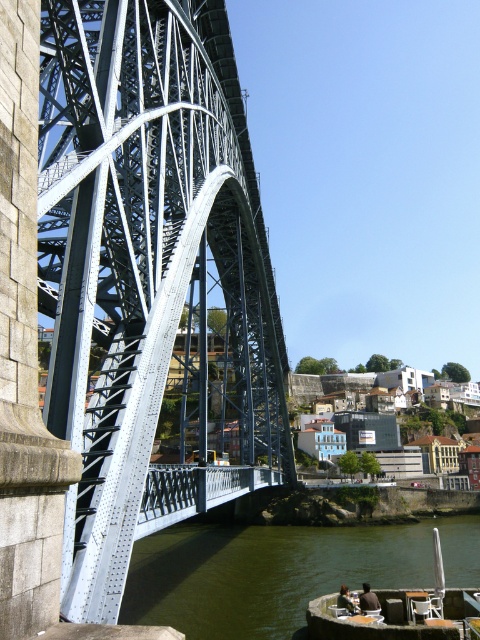
Question: Can you confirm if greenish water at lower center is bigger than wooden boat at lower right?

Choices:
 (A) no
 (B) yes

Answer: (B)

Question: Considering the real-world distances, which object is closest to the metallic steel arch bridge at left?

Choices:
 (A) greenish water at lower center
 (B) wooden boat at lower right

Answer: (A)

Question: Considering the real-world distances, which object is closest to the wooden boat at lower right?

Choices:
 (A) greenish water at lower center
 (B) metallic steel arch bridge at left

Answer: (A)

Question: Which object appears closest to the camera in this image?

Choices:
 (A) metallic steel arch bridge at left
 (B) greenish water at lower center
 (C) wooden boat at lower right

Answer: (A)

Question: Where is metallic steel arch bridge at left located in relation to greenish water at lower center in the image?

Choices:
 (A) left
 (B) right

Answer: (A)

Question: Does greenish water at lower center have a greater width compared to wooden boat at lower right?

Choices:
 (A) no
 (B) yes

Answer: (B)